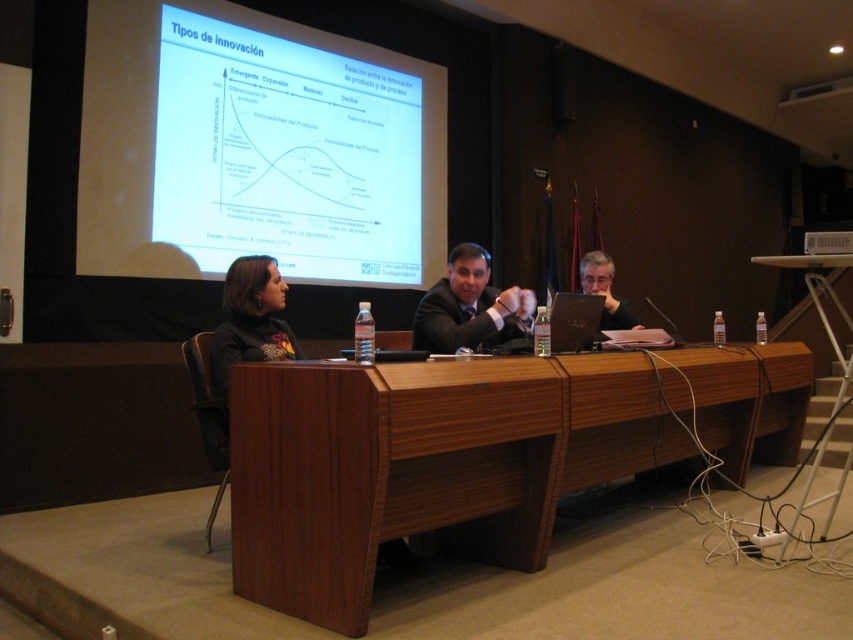
Between dark suit at center and black plastic projector at upper right, which one appears on the right side from the viewer's perspective?

From the viewer's perspective, black plastic projector at upper right appears more on the right side.

Which is in front, point (471, 275) or point (805, 252)?

Point (805, 252) is more forward.

Locate an element on the screen. The height and width of the screenshot is (640, 853). dark suit at center is located at coordinates (469, 307).

In the scene shown: Is dark suit at center smaller than dark brown leather jacket at left?

No.

Is dark suit at center bigger than dark brown leather jacket at left?

Yes, dark suit at center is bigger than dark brown leather jacket at left.

Who is more distant from viewer, (x=436, y=285) or (x=230, y=269)?

The point (x=436, y=285) is more distant.

Identify the location of dark suit at center. The image size is (853, 640). (469, 307).

Does dark brown leather jacket at left come behind black plastic projector at upper right?

Yes, it is.

Looking at this image, between dark brown leather jacket at left and black plastic projector at upper right, which one is positioned lower?

dark brown leather jacket at left is below.

Is point (236, 362) farther from camera compared to point (845, 240)?

Yes, point (236, 362) is behind point (845, 240).

Where is `dark brown leather jacket at left`? The width and height of the screenshot is (853, 640). dark brown leather jacket at left is located at coordinates (250, 320).